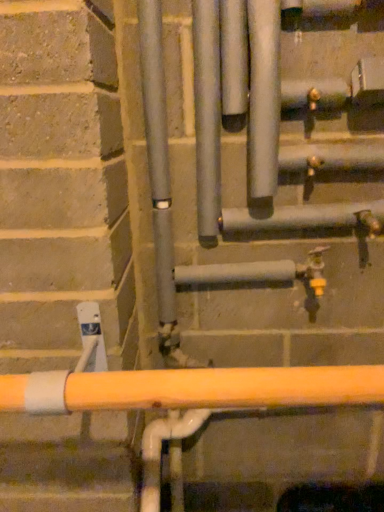
Question: Which direction should I rotate to face satin silver pipes at center, which is the second pipe in right-to-left order, — up or down?

Choices:
 (A) up
 (B) down

Answer: (A)

Question: Can you confirm if satin silver pipe at upper center, which is the first pipe from right to left, is shorter than satin silver pipes at center, which is the 1th pipe in left-to-right order?

Choices:
 (A) yes
 (B) no

Answer: (B)

Question: From the image's perspective, is satin silver pipe at upper center, which is the 2th pipe in left-to-right order, beneath satin silver pipes at center, which is the 1th pipe in left-to-right order?

Choices:
 (A) yes
 (B) no

Answer: (B)

Question: Does satin silver pipe at upper center, which is the first pipe from right to left, have a greater height compared to satin silver pipes at center, which is the second pipe in right-to-left order?

Choices:
 (A) yes
 (B) no

Answer: (A)

Question: Is there a large distance between satin silver pipe at upper center, which is the 2th pipe in left-to-right order, and satin silver pipes at center, which is the 1th pipe in left-to-right order?

Choices:
 (A) yes
 (B) no

Answer: (B)

Question: Is satin silver pipe at upper center, which is the 2th pipe in left-to-right order, positioned in front of satin silver pipes at center, which is the second pipe in right-to-left order?

Choices:
 (A) no
 (B) yes

Answer: (B)

Question: Is satin silver pipe at upper center, which is the first pipe from right to left, completely or partially outside of satin silver pipes at center, which is the second pipe in right-to-left order?

Choices:
 (A) no
 (B) yes

Answer: (B)

Question: Is satin silver pipes at center, which is the 1th pipe in left-to-right order, not inside satin silver pipe at upper center, which is the first pipe from right to left?

Choices:
 (A) yes
 (B) no

Answer: (A)

Question: Does satin silver pipes at center, which is the second pipe in right-to-left order, have a greater width compared to satin silver pipe at upper center, which is the first pipe from right to left?

Choices:
 (A) yes
 (B) no

Answer: (B)

Question: Can you confirm if satin silver pipes at center, which is the second pipe in right-to-left order, is bigger than satin silver pipe at upper center, which is the 2th pipe in left-to-right order?

Choices:
 (A) no
 (B) yes

Answer: (A)

Question: Does satin silver pipes at center, which is the second pipe in right-to-left order, appear on the left side of satin silver pipe at upper center, which is the first pipe from right to left?

Choices:
 (A) no
 (B) yes

Answer: (B)

Question: Are satin silver pipes at center, which is the second pipe in right-to-left order, and satin silver pipe at upper center, which is the first pipe from right to left, far apart?

Choices:
 (A) yes
 (B) no

Answer: (B)

Question: Does satin silver pipes at center, which is the 1th pipe in left-to-right order, have a lesser height compared to satin silver pipe at upper center, which is the first pipe from right to left?

Choices:
 (A) no
 (B) yes

Answer: (B)

Question: In terms of width, does satin silver pipe at upper center, which is the 2th pipe in left-to-right order, look wider or thinner when compared to satin silver pipes at center, which is the second pipe in right-to-left order?

Choices:
 (A) thin
 (B) wide

Answer: (B)